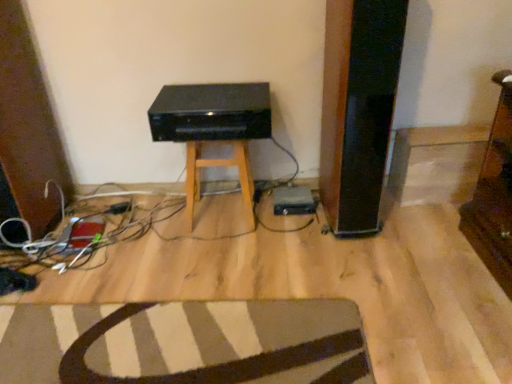
The height and width of the screenshot is (384, 512). I want to click on free space above black plastic stereo at center (from a real-world perspective), so click(x=221, y=90).